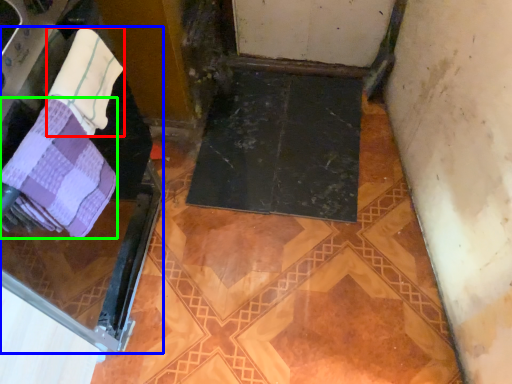
Question: Estimate the real-world distances between objects in this image. Which object is closer to towel (highlighted by a red box), screen door (highlighted by a blue box) or towel (highlighted by a green box)?

Choices:
 (A) screen door
 (B) towel

Answer: (B)